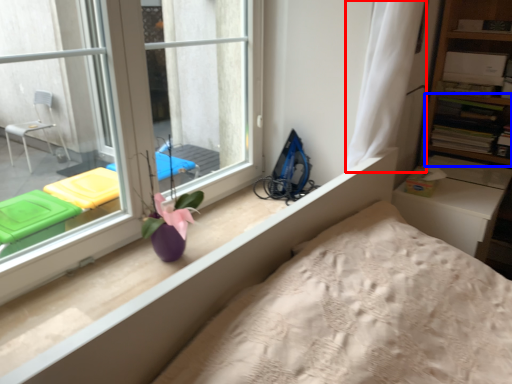
Question: Among these objects, which one is nearest to the camera, curtain (highlighted by a red box) or shelf (highlighted by a blue box)?

Choices:
 (A) curtain
 (B) shelf

Answer: (A)